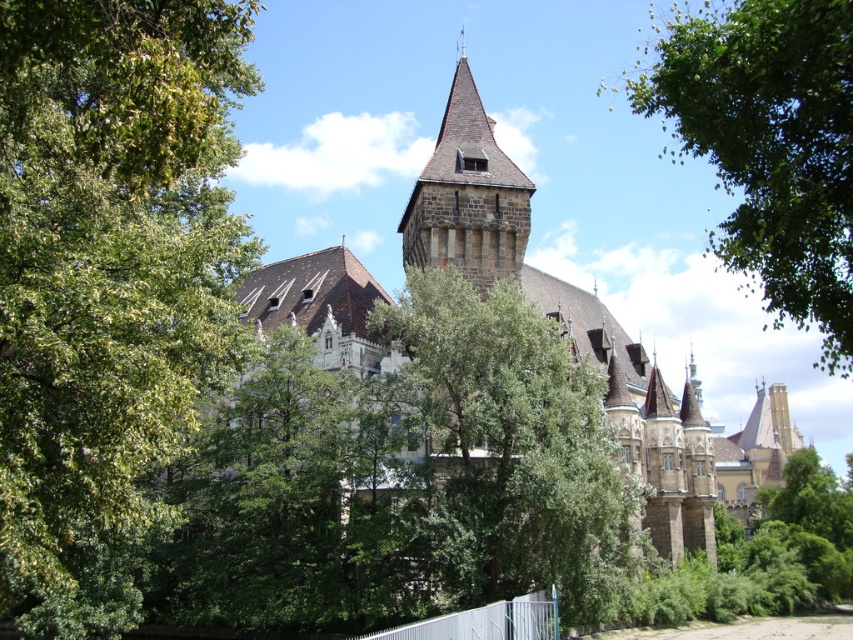
Image resolution: width=853 pixels, height=640 pixels. Describe the element at coordinates (108, 257) in the screenshot. I see `green leafy tree at upper left` at that location.

How far apart are green leafy tree at upper left and brown tiled roof at center?

green leafy tree at upper left is 34.40 meters from brown tiled roof at center.

Is point (175, 182) positioned after point (621, 392)?

No, (175, 182) is closer to viewer.

The image size is (853, 640). I want to click on green leafy tree at upper left, so click(x=108, y=257).

Does point (593, 516) come closer to viewer compared to point (848, 272)?

No, it is not.

Describe the element at coordinates (505, 449) in the screenshot. I see `green leafy tree at center` at that location.

Where is `green leafy tree at center`? The width and height of the screenshot is (853, 640). green leafy tree at center is located at coordinates coord(505,449).

Does brown tiled roof at center have a greater width compared to green leafy tree at upper right?

Yes, brown tiled roof at center is wider than green leafy tree at upper right.

Which is above, brown tiled roof at center or green leafy tree at upper right?

green leafy tree at upper right

Where is `brown tiled roof at center`? brown tiled roof at center is located at coordinates (592, 337).